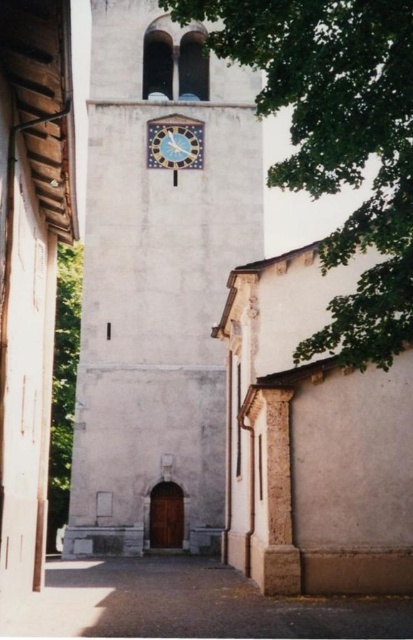
Which is in front, point (272, 67) or point (52, 515)?

Point (272, 67) is more forward.

Who is more forward, (403, 60) or (68, 317)?

Point (403, 60)

Where is `green leafy tree at upper center`? The width and height of the screenshot is (413, 640). green leafy tree at upper center is located at coordinates (337, 141).

Between point (360, 168) and point (171, 611), which one is positioned behind?

Positioned behind is point (360, 168).

Is point (334, 164) positioned before point (92, 564)?

Yes, point (334, 164) is in front of point (92, 564).

Where is `green leafy tree at upper center`? The height and width of the screenshot is (640, 413). green leafy tree at upper center is located at coordinates (337, 141).

Is point (227, 125) positioned in front of point (194, 160)?

No, (227, 125) is behind (194, 160).

Describe the element at coordinates (158, 284) in the screenshot. I see `white stone clock tower at center` at that location.

Identify the location of white stone clock tower at center. The height and width of the screenshot is (640, 413). tap(158, 284).